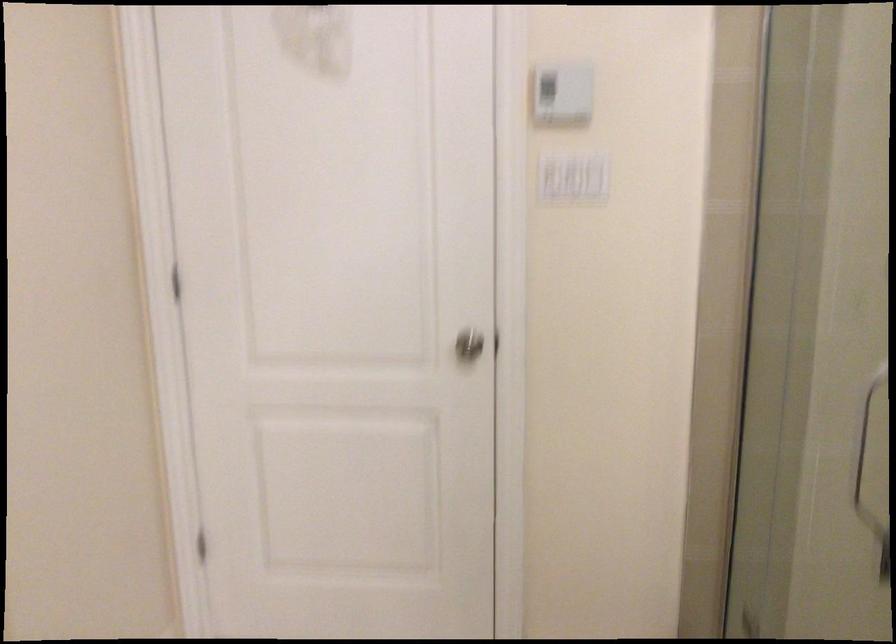
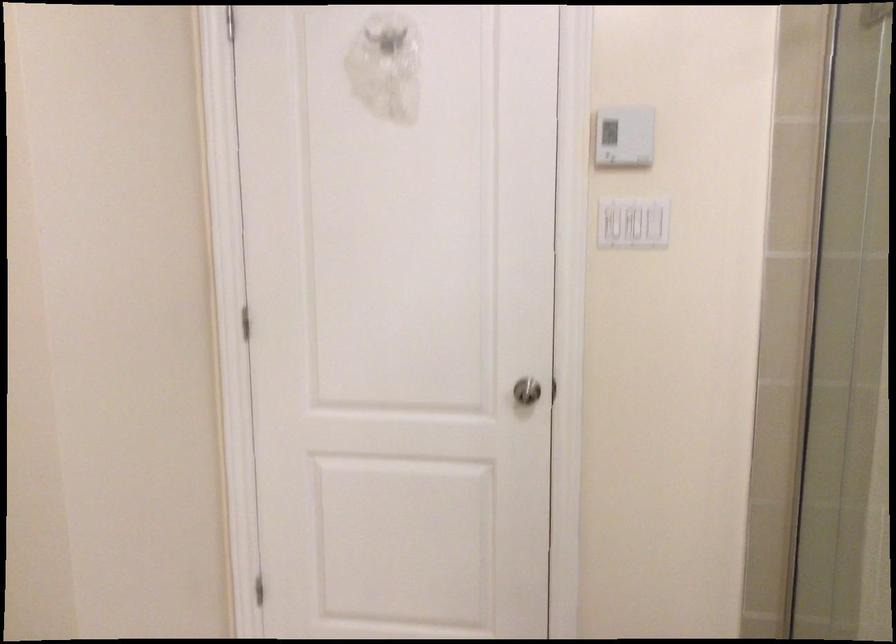
Locate, in the second image, the point that corresponds to (x=467, y=305) in the first image.

(526, 391)